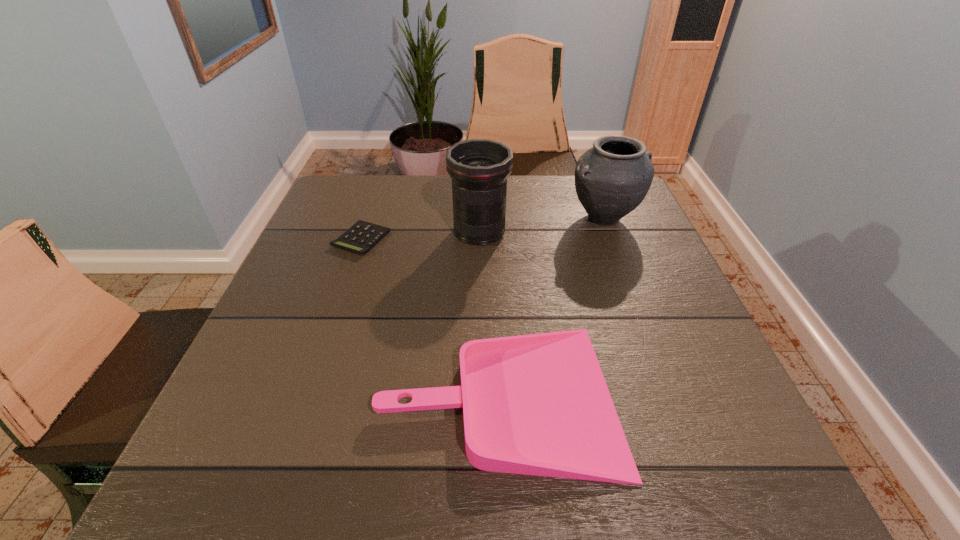
This screenshot has height=540, width=960. Identify the location of free spot located on the handle side of the dustpan. 275,396.

Locate an element on the screen. The width and height of the screenshot is (960, 540). free space located on the right of the shortest object is located at coordinates (520, 239).

Where is `telephoto lens at the far edge`? telephoto lens at the far edge is located at coordinates (479, 168).

The width and height of the screenshot is (960, 540). I want to click on urn that is at the far edge, so click(612, 178).

The image size is (960, 540). Find the location of `object located at the near edge`. object located at the near edge is located at coordinates (538, 404).

Locate an element on the screen. The width and height of the screenshot is (960, 540). object at the left edge is located at coordinates (360, 238).

You are a GUI agent. You are given a task and a screenshot of the screen. Output one action in this format:
    pyautogui.click(x=<x>, y=<y>)
    Task: Click on the object located in the right edge section of the desktop
    
    Given the screenshot: What is the action you would take?
    (x=612, y=178)

Where is `object located in the far right corner section of the desktop`? This screenshot has height=540, width=960. object located in the far right corner section of the desktop is located at coordinates (612, 178).

The image size is (960, 540). In the image, there is a desktop. Find the location of `vacant space at the far edge`. vacant space at the far edge is located at coordinates (442, 218).

Locate an element on the screen. The height and width of the screenshot is (540, 960). vacant space at the near edge of the desktop is located at coordinates (579, 482).